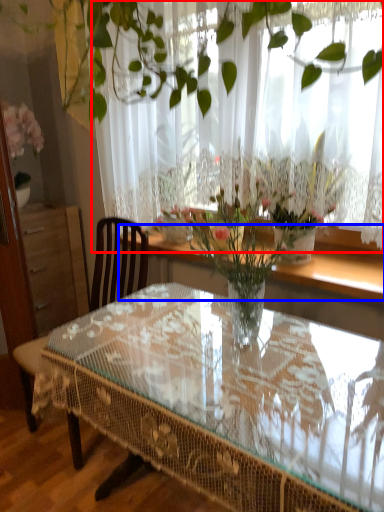
Question: Among these objects, which one is farthest to the camera, curtain (highlighted by a red box) or window sill (highlighted by a blue box)?

Choices:
 (A) curtain
 (B) window sill

Answer: (B)